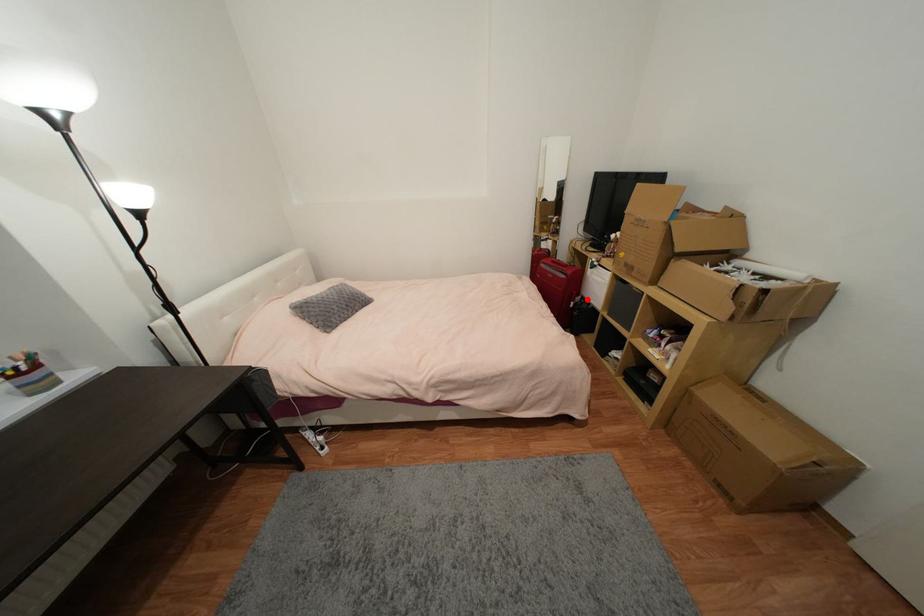
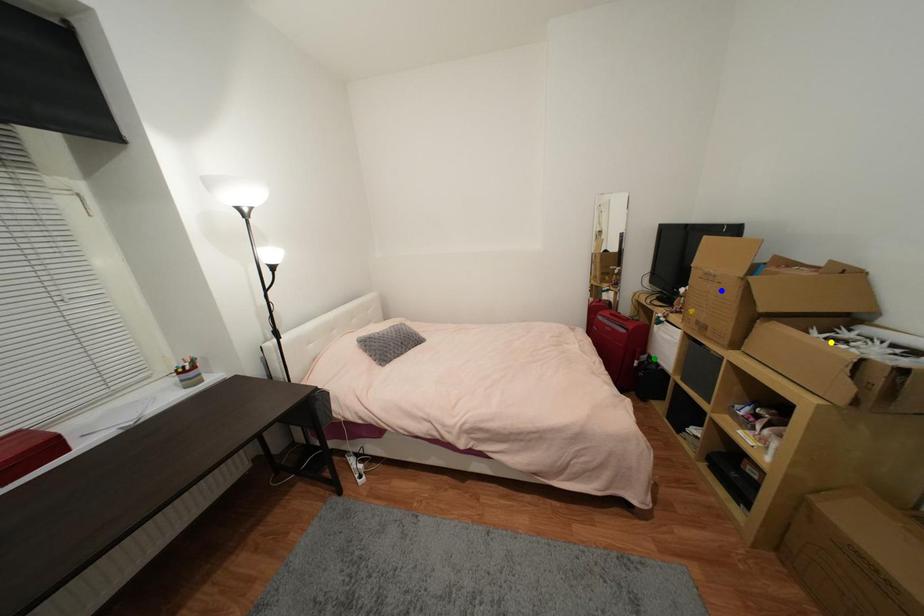
Question: I am providing you with two images of the same scene from different viewpoints. A red point is marked on the first image. You are given multiple points on the second image. Which point in image 2 represents the same 3d spot as the red point in image 1?

Choices:
 (A) yellow point
 (B) blue point
 (C) green point

Answer: (C)